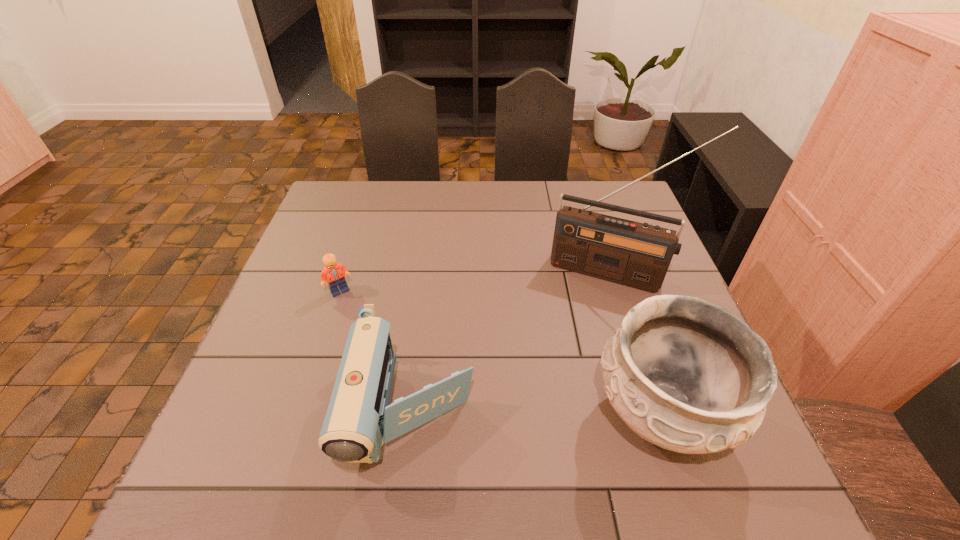
This screenshot has width=960, height=540. Identify the location of vacant space located 0.130m on the front-facing side of the tallest object. (582, 328).

Identify the location of free space located on the front-facing side of the tallest object. (571, 360).

Identify the location of blank space located 0.220m on the front-facing side of the tallest object. (572, 357).

Find the location of a particular element. camcorder present at the near edge is located at coordinates (359, 419).

Locate an element on the screen. pottery that is at the near edge is located at coordinates (689, 376).

Identify the location of object that is at the left edge. (335, 273).

In order to click on pottery that is positioned at the right edge in this screenshot , I will do `click(689, 376)`.

Identify the location of radio receiver that is positioned at the right edge. (637, 255).

Identify the location of object that is at the near right corner. The width and height of the screenshot is (960, 540). (689, 376).

The image size is (960, 540). What are the coordinates of `free region at the far edge of the desktop` in the screenshot? It's located at (539, 199).